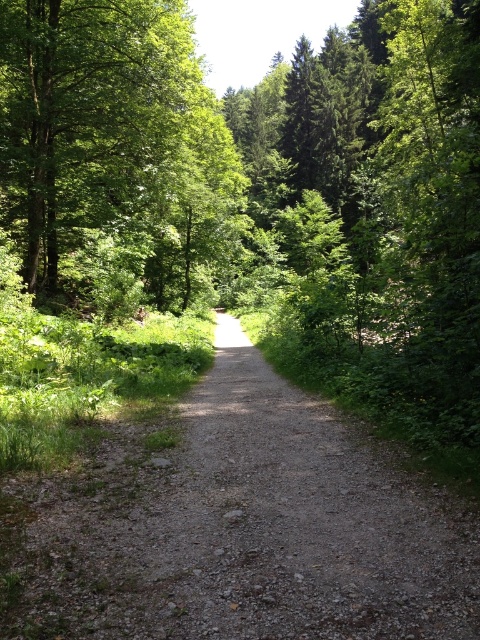
Question: Is the position of gray gravel path at center more distant than that of green leafy tree at upper left?

Choices:
 (A) no
 (B) yes

Answer: (A)

Question: Does gray gravel path at center appear over green leafy tree at upper left?

Choices:
 (A) no
 (B) yes

Answer: (A)

Question: Observing the image, what is the correct spatial positioning of gray gravel path at center in reference to green leafy tree at upper left?

Choices:
 (A) below
 (B) above

Answer: (A)

Question: Which point is closer to the camera?

Choices:
 (A) gray gravel path at center
 (B) green leafy tree at upper left

Answer: (A)

Question: Which of the following is the closest to the observer?

Choices:
 (A) (73, 147)
 (B) (415, 596)

Answer: (B)